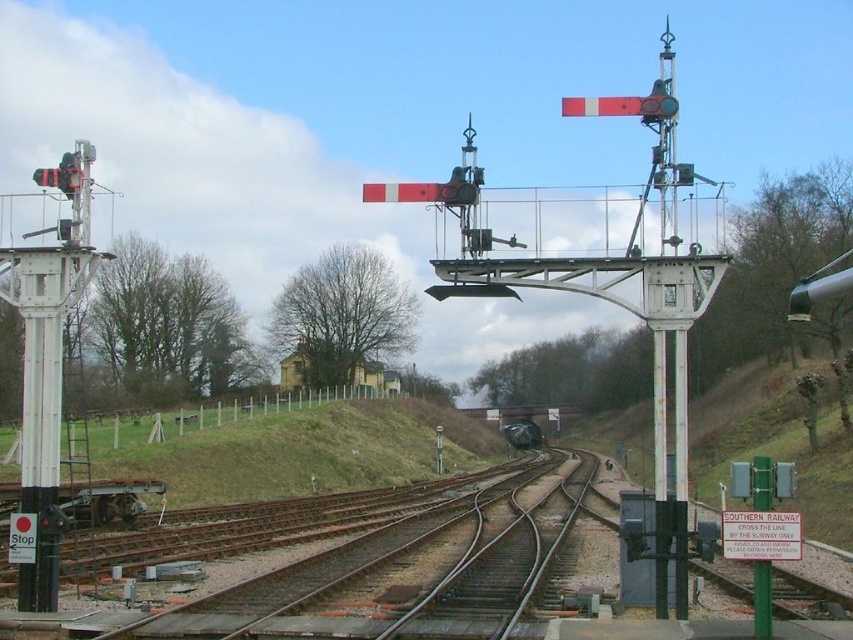
You are a train engineer who needs to ensure the metallic gray train at center can safely pass over the brown metal train track at center. Based on the scene description, is there any concern about the train being too low to clear the track?

The brown metal train track at center has a greater height compared to metallic gray train at center. This means the train is lower than the track, which could pose a risk of collision or scraping. The engineer should check the clearance to ensure safe passage.